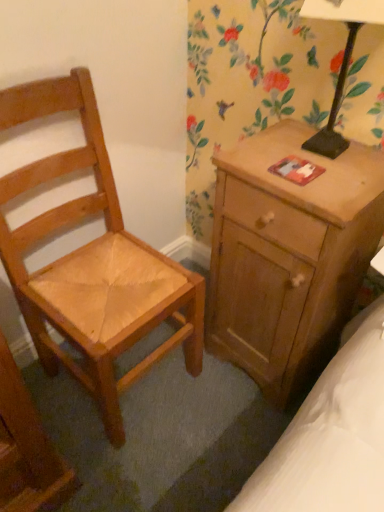
Question: Would you say wooden nightstand at right contains black metal table lamp at upper right?

Choices:
 (A) no
 (B) yes

Answer: (A)

Question: From a real-world perspective, is wooden nightstand at right over black metal table lamp at upper right?

Choices:
 (A) no
 (B) yes

Answer: (A)

Question: Is wooden nightstand at right closer to camera compared to black metal table lamp at upper right?

Choices:
 (A) no
 (B) yes

Answer: (A)

Question: Is wooden nightstand at right facing towards black metal table lamp at upper right?

Choices:
 (A) no
 (B) yes

Answer: (A)

Question: Is the depth of wooden nightstand at right greater than that of black metal table lamp at upper right?

Choices:
 (A) yes
 (B) no

Answer: (A)

Question: From the image's perspective, is wooden nightstand at right above or below black metal table lamp at upper right?

Choices:
 (A) above
 (B) below

Answer: (B)

Question: Does point (249, 348) appear closer or farther from the camera than point (327, 119)?

Choices:
 (A) farther
 (B) closer

Answer: (A)

Question: Considering the positions of wooden nightstand at right and black metal table lamp at upper right in the image, is wooden nightstand at right taller or shorter than black metal table lamp at upper right?

Choices:
 (A) tall
 (B) short

Answer: (A)

Question: From a real-world perspective, is wooden nightstand at right above or below black metal table lamp at upper right?

Choices:
 (A) below
 (B) above

Answer: (A)

Question: From the image's perspective, relative to black metal table lamp at upper right, is light brown wooden chair at left above or below?

Choices:
 (A) below
 (B) above

Answer: (A)

Question: In terms of size, does light brown wooden chair at left appear bigger or smaller than black metal table lamp at upper right?

Choices:
 (A) big
 (B) small

Answer: (A)

Question: From a real-world perspective, is light brown wooden chair at left physically located above or below black metal table lamp at upper right?

Choices:
 (A) below
 (B) above

Answer: (A)

Question: Considering the positions of light brown wooden chair at left and black metal table lamp at upper right in the image, is light brown wooden chair at left wider or thinner than black metal table lamp at upper right?

Choices:
 (A) thin
 (B) wide

Answer: (B)

Question: In terms of width, does black metal table lamp at upper right look wider or thinner when compared to wooden nightstand at right?

Choices:
 (A) thin
 (B) wide

Answer: (A)

Question: Considering their positions, is black metal table lamp at upper right located in front of or behind wooden nightstand at right?

Choices:
 (A) behind
 (B) front

Answer: (B)